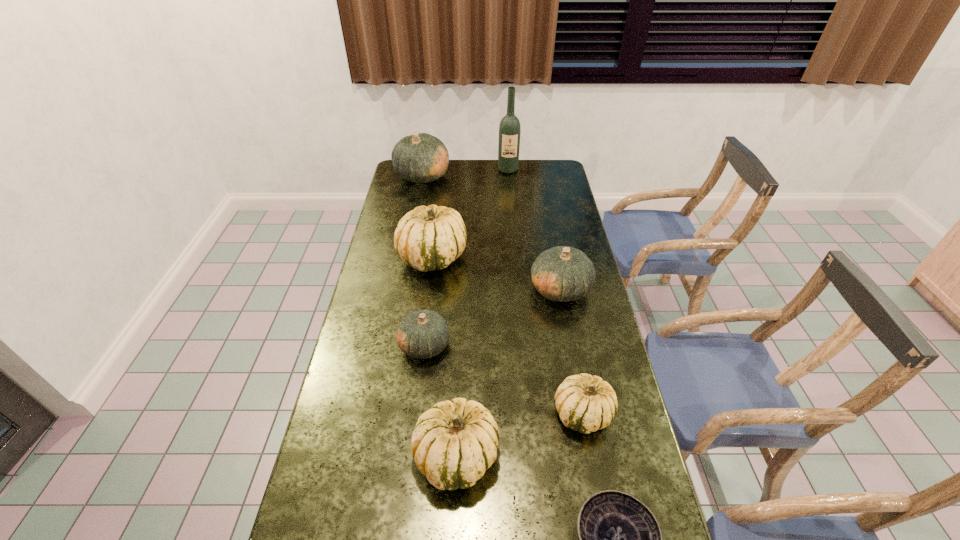
Locate an element on the screen. The height and width of the screenshot is (540, 960). the rightmost white gourd is located at coordinates (585, 403).

This screenshot has width=960, height=540. Find the location of `vacant space located 0.370m on the labeled side of the wine bottle`. vacant space located 0.370m on the labeled side of the wine bottle is located at coordinates (513, 221).

Where is `vacant space located 0.340m on the right of the farthest orange gourd`? vacant space located 0.340m on the right of the farthest orange gourd is located at coordinates (521, 176).

Find the location of a particular element. The width and height of the screenshot is (960, 540). free region located on the back of the farthest white gourd is located at coordinates (441, 192).

This screenshot has height=540, width=960. I want to click on free region located 0.200m on the left of the second biggest orange gourd, so [x=472, y=289].

Where is `vacant space situated 0.200m on the right of the second biggest white gourd`? The height and width of the screenshot is (540, 960). vacant space situated 0.200m on the right of the second biggest white gourd is located at coordinates (579, 455).

Find the location of a particular element. This screenshot has height=540, width=960. free location located on the back of the third nearest gourd is located at coordinates (436, 248).

Where is `free region located 0.210m on the front of the rightmost white gourd`? free region located 0.210m on the front of the rightmost white gourd is located at coordinates (605, 532).

Find the location of `wine bottle that is at the far edge`. wine bottle that is at the far edge is located at coordinates (509, 129).

Locate an element on the screen. gourd that is at the far edge is located at coordinates (419, 158).